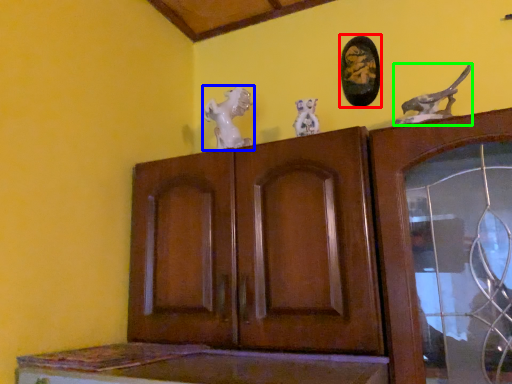
Question: Which is farther away from picture frame (highlighted by a red box)? animal (highlighted by a blue box) or animal (highlighted by a green box)?

Choices:
 (A) animal
 (B) animal

Answer: (A)